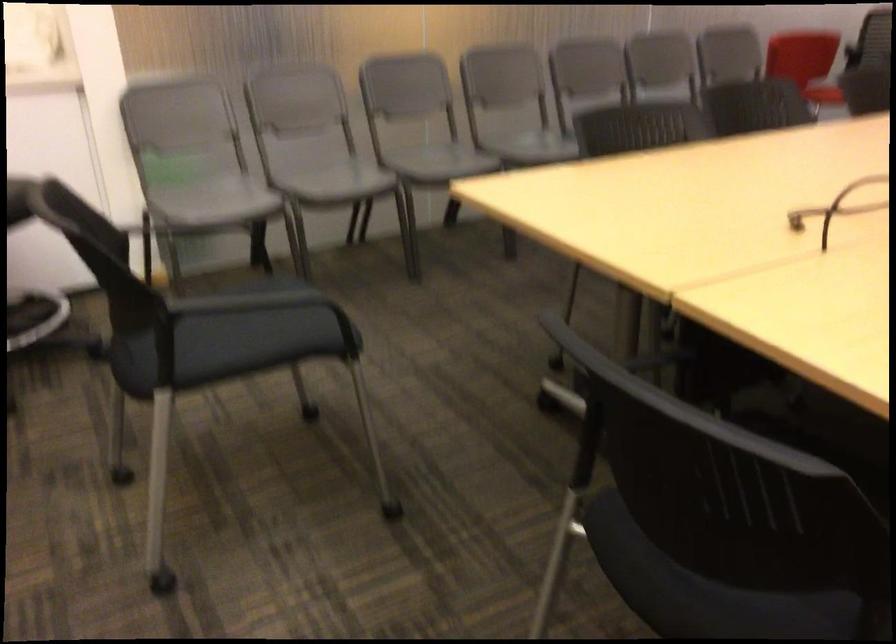
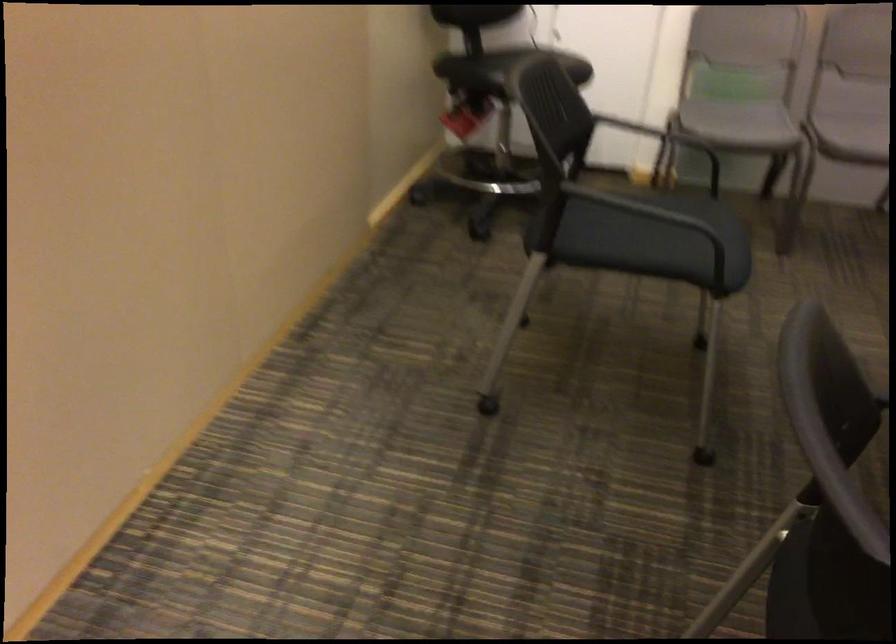
Locate, in the second image, the point that corresponds to (642,558) in the first image.

(826, 585)